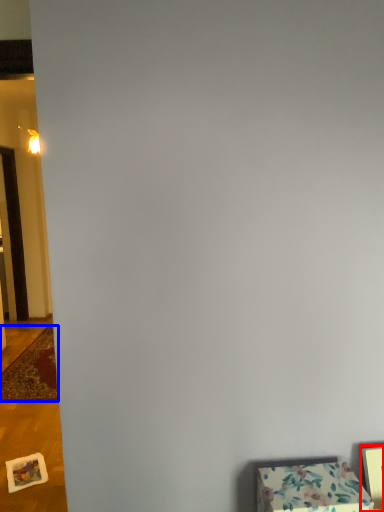
Question: Among these objects, which one is farthest to the camera, picture frame (highlighted by a red box) or mat (highlighted by a blue box)?

Choices:
 (A) picture frame
 (B) mat

Answer: (B)